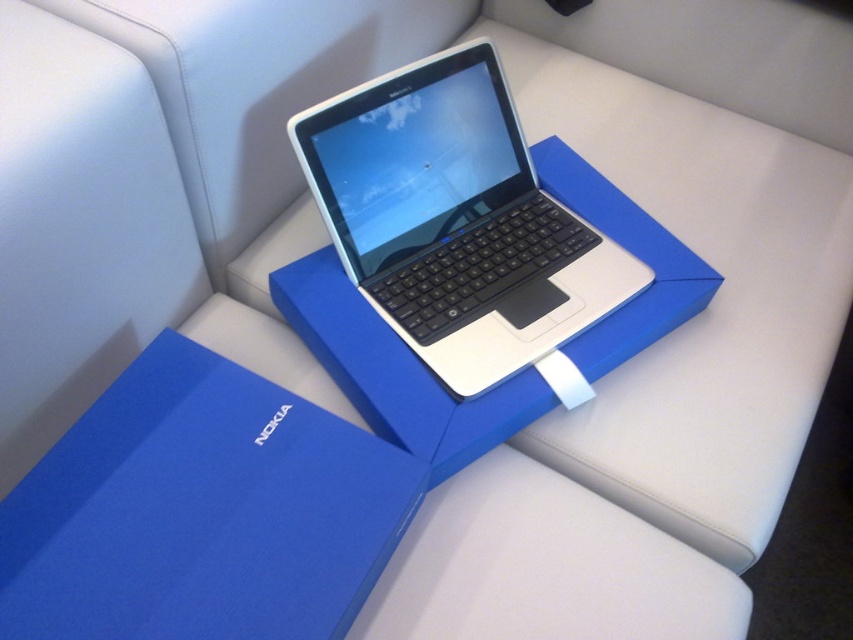
Question: Which object appears closest to the camera in this image?

Choices:
 (A) blue matte cardboard box at center
 (B) white glossy laptop at center

Answer: (A)

Question: Can you confirm if blue matte cardboard box at center is wider than white glossy laptop at center?

Choices:
 (A) yes
 (B) no

Answer: (B)

Question: Which object is closer to the camera taking this photo?

Choices:
 (A) white glossy laptop at center
 (B) blue matte cardboard box at center

Answer: (B)

Question: Which of the following is the farthest from the observer?

Choices:
 (A) (357, 244)
 (B) (39, 628)

Answer: (A)

Question: Considering the relative positions of blue matte cardboard box at center and white glossy laptop at center in the image provided, where is blue matte cardboard box at center located with respect to white glossy laptop at center?

Choices:
 (A) below
 (B) above

Answer: (A)

Question: Is blue matte cardboard box at center positioned behind white glossy laptop at center?

Choices:
 (A) no
 (B) yes

Answer: (A)